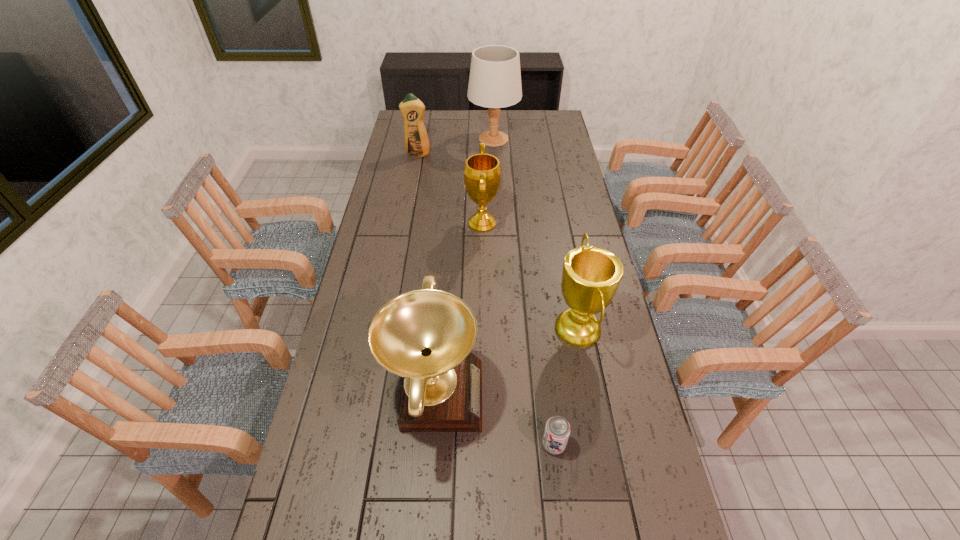
This screenshot has height=540, width=960. What are the coordinates of `free spot that satisfies the following two spatial constraints: 1. on the back side of the beer can; 2. on the front-facing side of the fourth nearest object` in the screenshot? It's located at (528, 224).